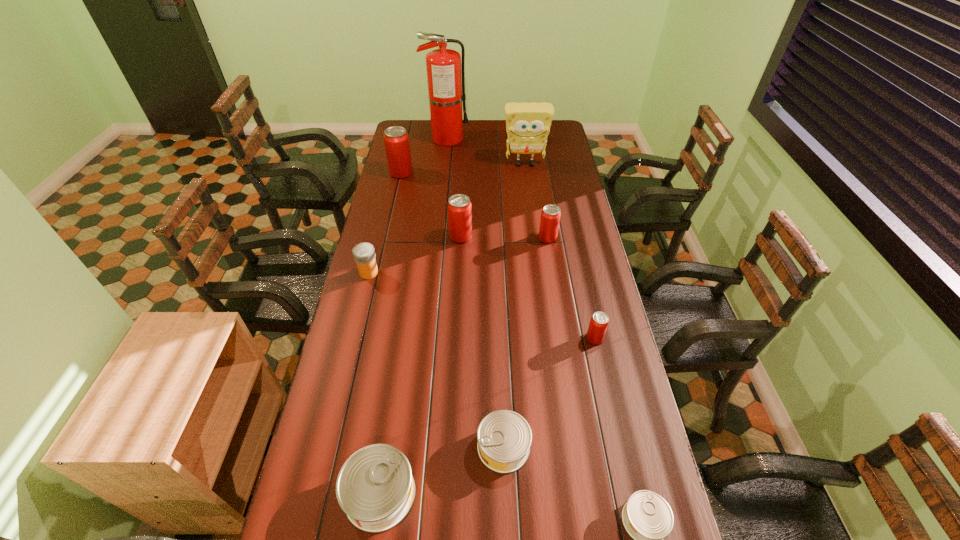
This screenshot has height=540, width=960. Identify the location of red fire extinguisher. (446, 89).

At what (x,y) coordinates should I click in order to perform the action: click on the tallest object. Please return your answer as a coordinate pair (x, y). Looking at the image, I should click on (446, 89).

In order to click on sponge in this screenshot , I will do `click(528, 125)`.

The height and width of the screenshot is (540, 960). I want to click on the farthest can, so click(396, 139).

Where is `the tallest can`? the tallest can is located at coordinates (396, 139).

At what (x,y) coordinates should I click in order to perform the action: click on the second biggest red can. Please return your answer as a coordinate pair (x, y). Looking at the image, I should click on (459, 207).

In order to click on the seventh shortest object in this screenshot , I will do `click(459, 207)`.

What are the coordinates of `the third red can from left to right` in the screenshot? It's located at (550, 217).

In order to click on the sixth shortest object in this screenshot , I will do point(550,217).

Where is `the sixth farthest object`? The width and height of the screenshot is (960, 540). the sixth farthest object is located at coordinates (364, 254).